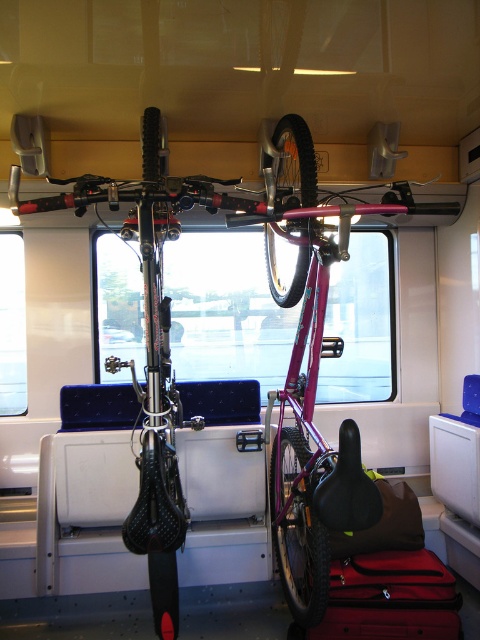
Question: Is matte black bicycle at center to the right of red fabric suitcase at lower center from the viewer's perspective?

Choices:
 (A) no
 (B) yes

Answer: (A)

Question: Among these objects, which one is farthest from the camera?

Choices:
 (A) red fabric suitcase at lower center
 (B) matte black bicycle at center

Answer: (A)

Question: Can you confirm if matte black bicycle at center is positioned below red fabric suitcase at lower center?

Choices:
 (A) no
 (B) yes

Answer: (A)

Question: Which object appears farthest from the camera in this image?

Choices:
 (A) matte black bicycle at center
 (B) red fabric suitcase at lower center

Answer: (B)

Question: Does matte black bicycle at center lie in front of red fabric suitcase at lower center?

Choices:
 (A) no
 (B) yes

Answer: (B)